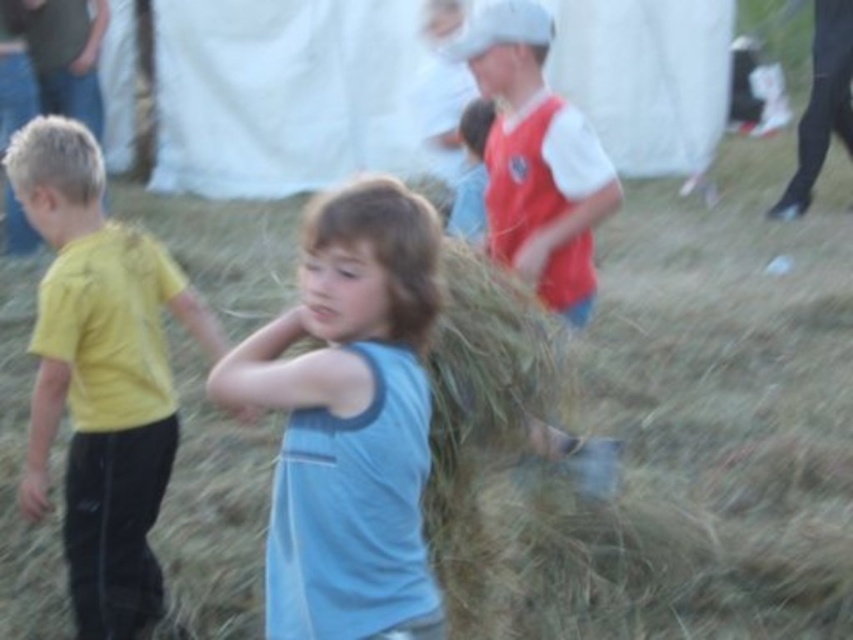
Is light blue cotton shirt at center wider than yellow matte shirt at left?

Incorrect, light blue cotton shirt at center's width does not surpass yellow matte shirt at left's.

Does light blue cotton shirt at center have a lesser height compared to yellow matte shirt at left?

Indeed, light blue cotton shirt at center has a lesser height compared to yellow matte shirt at left.

This screenshot has width=853, height=640. I want to click on light blue cotton shirt at center, so click(x=349, y=419).

Who is more distant from viewer, [76,566] or [509,72]?

Point [509,72]

Can you confirm if yellow matte shirt at left is positioned to the left of red jersey at center?

Correct, you'll find yellow matte shirt at left to the left of red jersey at center.

Identify the location of yellow matte shirt at left. This screenshot has height=640, width=853. (100, 374).

Does light blue cotton shirt at center appear on the right side of red jersey at center?

Incorrect, light blue cotton shirt at center is not on the right side of red jersey at center.

From the picture: Can you confirm if light blue cotton shirt at center is bigger than red jersey at center?

Actually, light blue cotton shirt at center might be smaller than red jersey at center.

Between point (373, 305) and point (495, 230), which one is positioned behind?

The point (495, 230) is more distant.

Find the location of `light blue cotton shirt at center`. light blue cotton shirt at center is located at coordinates (349, 419).